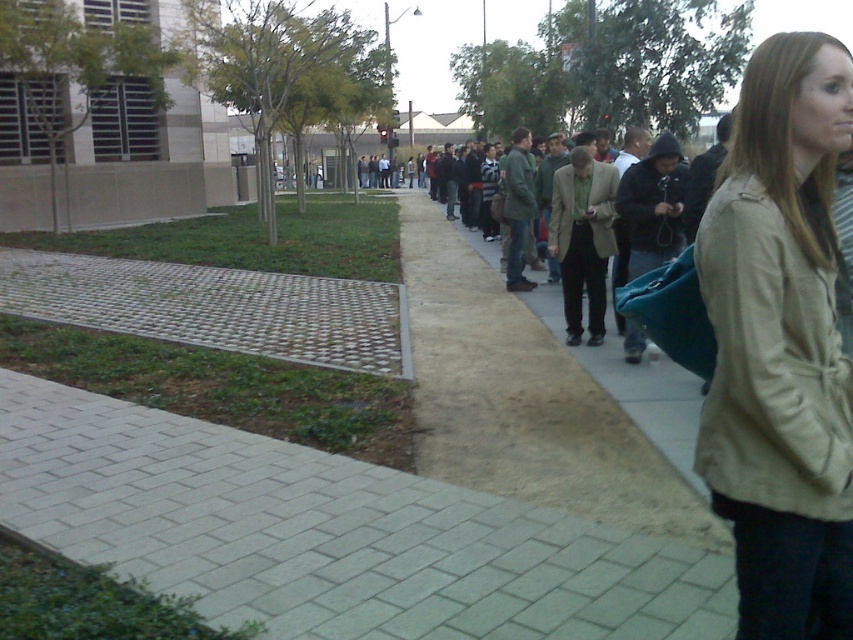
Question: Estimate the real-world distances between objects in this image. Which object is closer to the beige fabric jacket at center?

Choices:
 (A) gray brick pavement at lower left
 (B) brown leather jacket at center
 (C) matte brown jacket at center

Answer: (A)

Question: Considering the real-world distances, which object is farthest from the gray brick pavement at lower left?

Choices:
 (A) beige fabric jacket at center
 (B) matte brown jacket at center
 (C) brown leather jacket at center

Answer: (B)

Question: Where is brown leather jacket at center located in relation to matte brown jacket at center in the image?

Choices:
 (A) below
 (B) above

Answer: (A)

Question: Considering the relative positions of gray brick pavement at lower left and brown leather jacket at center in the image provided, where is gray brick pavement at lower left located with respect to brown leather jacket at center?

Choices:
 (A) above
 (B) below

Answer: (B)

Question: Observing the image, what is the correct spatial positioning of gray brick pavement at lower left in reference to brown leather jacket at center?

Choices:
 (A) below
 (B) above

Answer: (A)

Question: Which object is the closest to the matte brown jacket at center?

Choices:
 (A) gray brick pavement at lower left
 (B) brown leather jacket at center
 (C) beige fabric jacket at center

Answer: (B)